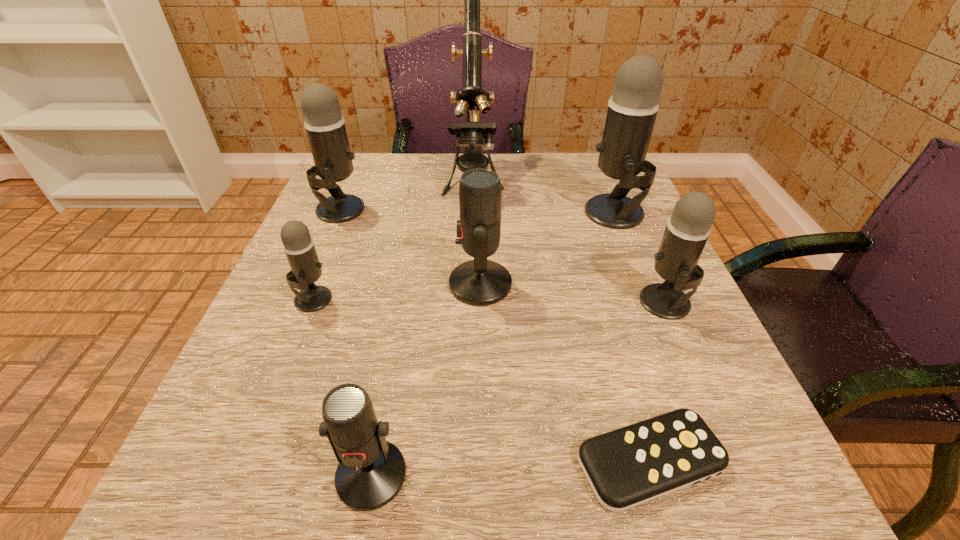
This screenshot has height=540, width=960. I want to click on free point that satisfies the following two spatial constraints: 1. on the side of the third biggest gray microphone with the red ring; 2. on the right side of the farther red microphone, so click(x=480, y=302).